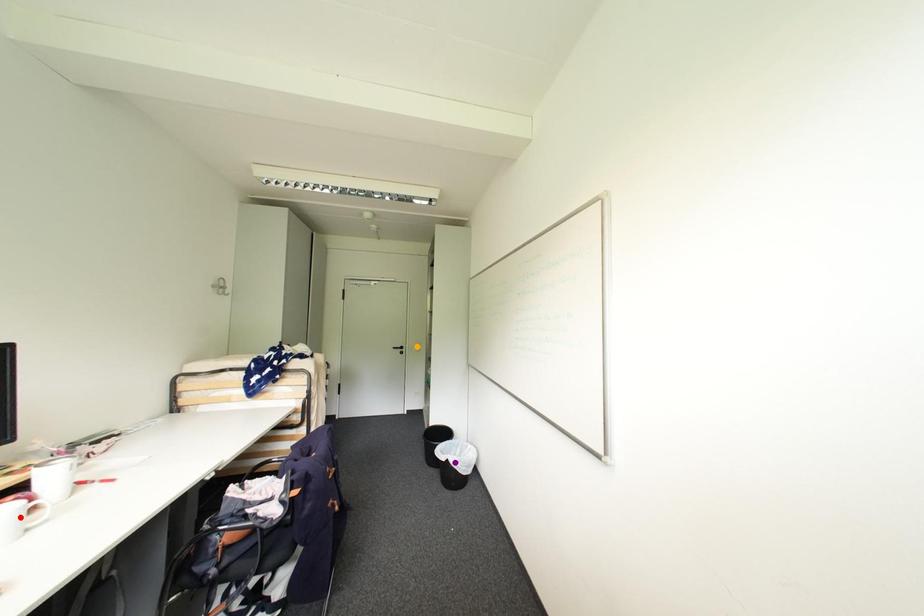
Order these from nearest to farthest:
red point | purple point | orange point

red point
purple point
orange point